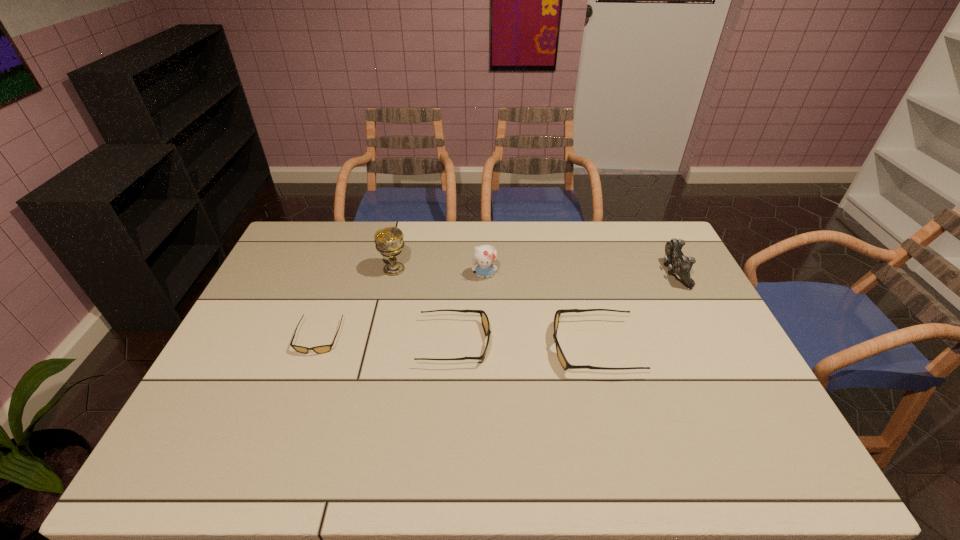
Locate an element on the screen. Image resolution: width=960 pixels, height=540 pixels. chalice at the far edge is located at coordinates (389, 241).

Find the location of a particular element. object located at the right edge is located at coordinates (678, 263).

What are the coordinates of `object that is at the far right corner` in the screenshot? It's located at (678, 263).

In order to click on vacant space at the far edge of the desktop in this screenshot , I will do `click(435, 233)`.

In the image, there is a desktop. At what (x,y) coordinates should I click in order to perform the action: click on vacant space at the near edge. Please return your answer as a coordinate pair (x, y). Looking at the image, I should click on 537,411.

The height and width of the screenshot is (540, 960). What are the coordinates of `vacant space at the right edge of the desktop` in the screenshot? It's located at (643, 272).

The width and height of the screenshot is (960, 540). I want to click on free spot at the far left corner of the desktop, so click(x=325, y=237).

In the image, there is a desktop. Find the location of `vacant space at the far right corner`. vacant space at the far right corner is located at coordinates (670, 241).

The height and width of the screenshot is (540, 960). I want to click on vacant area between the second tallest object and the second object from left to right, so click(x=440, y=272).

You are a GUI agent. You are given a task and a screenshot of the screen. Output one action in this format:
    pyautogui.click(x=<x>, y=<y>)
    Task: Click on the vacant area between the shortest sunglasses and the second shortest sunglasses
    This screenshot has width=960, height=540.
    Given the screenshot: What is the action you would take?
    pyautogui.click(x=387, y=340)